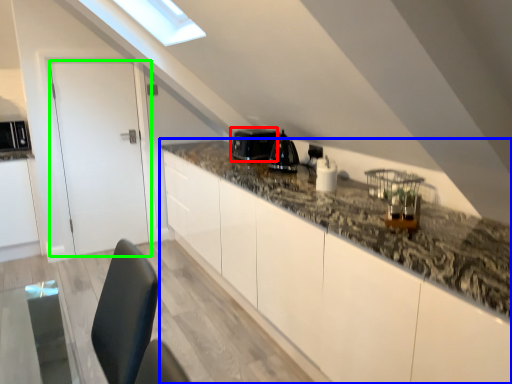
Question: Estimate the real-world distances between objects in this image. Which object is closer to appliance (highlighted by a red box), countertop (highlighted by a blue box) or door (highlighted by a green box)?

Choices:
 (A) countertop
 (B) door

Answer: (A)